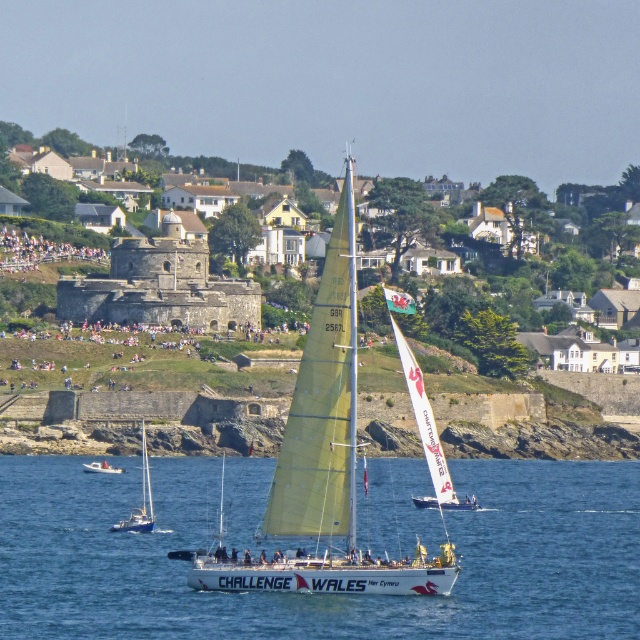
You are a photographer standing on the shore and want to capture both the white sailboat at lower left and the white plastic boat at lower left in a single photo. The camera you are using has a maximum focal length that allows capturing objects up to 8 meters apart in the frame. Will you be able to include both boats in your photo?

The white sailboat at lower left and white plastic boat at lower left are 8.35 meters apart from each other. Since the camera can only capture up to 8 meters, the distance between them is too great to fit both in the photo.

You are a photographer planning to take a photo of the white matte sailboat at center and the white plastic boat at lower left. Since both are white, you want to ensure they are distinguishable in the photo. Which boat should you focus on to capture more details due to its size?

The white matte sailboat at center is larger than the white plastic boat at lower left, so focusing on the white matte sailboat at center will allow you to capture more details due to its size.